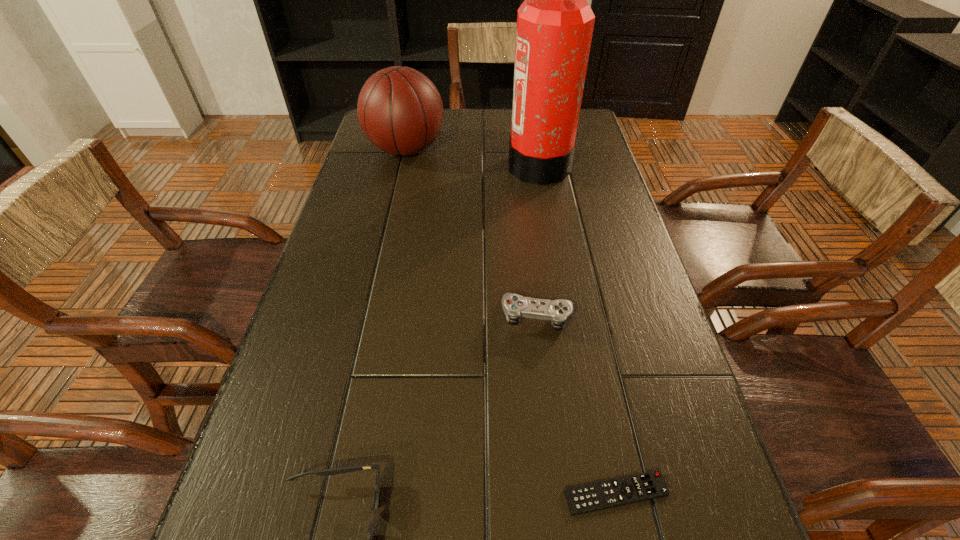
Find the location of a particular element. object that is the closest to the basketball is located at coordinates [555, 23].

Locate an element on the screen. This screenshot has width=960, height=540. free spot that satisfies the following two spatial constraints: 1. on the front side of the tallest object; 2. on the right side of the shortest object is located at coordinates (595, 493).

Find the location of a particular element. free location that satisfies the following two spatial constraints: 1. on the front side of the fire extinguisher; 2. on the right side of the remote control is located at coordinates (595, 493).